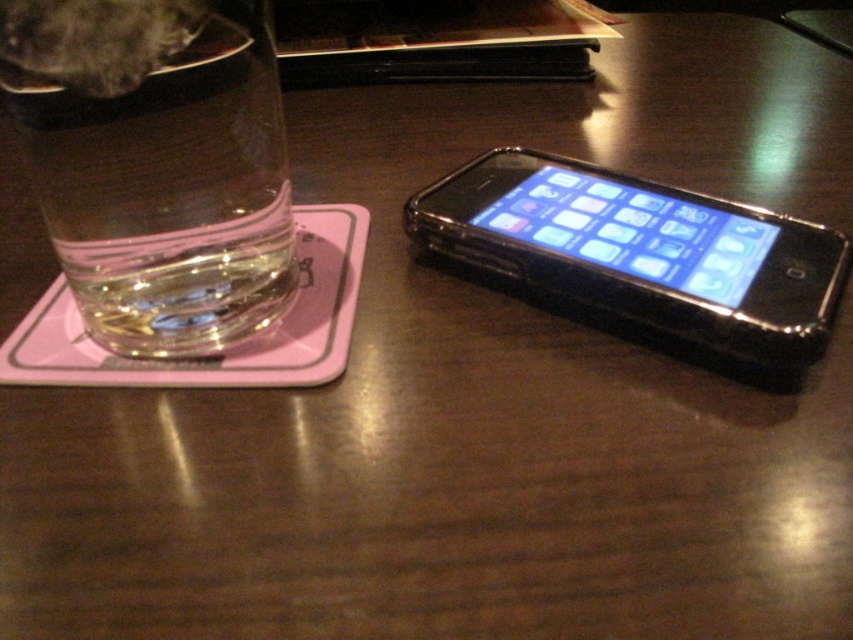
Can you confirm if clear glass at left is thinner than black plastic smartphone at right?

Indeed, clear glass at left has a lesser width compared to black plastic smartphone at right.

Is clear glass at left taller than black plastic smartphone at right?

Yes.

The width and height of the screenshot is (853, 640). What do you see at coordinates (169, 192) in the screenshot?
I see `clear glass at left` at bounding box center [169, 192].

Image resolution: width=853 pixels, height=640 pixels. Identify the location of clear glass at left. (169, 192).